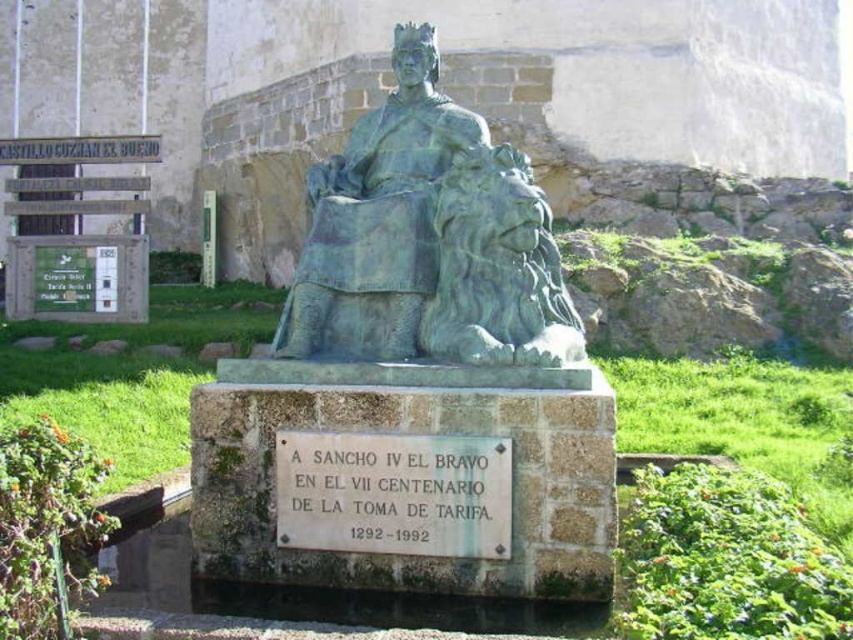
You are planning to place a decorative garden ornament that is 1.5 meters wide in this park scene. The ornament must be placed next to the green patina statue at center and the white stone plaque at center. Given their widths, can the ornament fit between them without overlapping?

The green patina statue at center is narrower than the white stone plaque at center. Since the ornament is 1.5 meters wide, you need to ensure the combined width of the statue and plaque allows space. However, without exact measurements, it is uncertain. Please verify the total available space.

You are a tour guide explaining the statue to visitors. Pointing to the green patina statue at center and the white stone plaque at center, you want to clarify their arrangement. Which object is located to the right of the other?

The white stone plaque at center is located to the right of the green patina statue at center because the statue is on the left side of the plaque.

What are the coordinates of the green patina statue at center?

The green patina statue at center is located at coordinates point (427, 240).